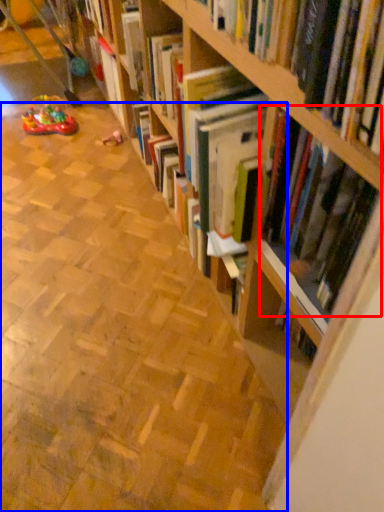
Question: Which of the following is the closest to the observer, book (highlighted by a red box) or aisle (highlighted by a blue box)?

Choices:
 (A) book
 (B) aisle

Answer: (A)